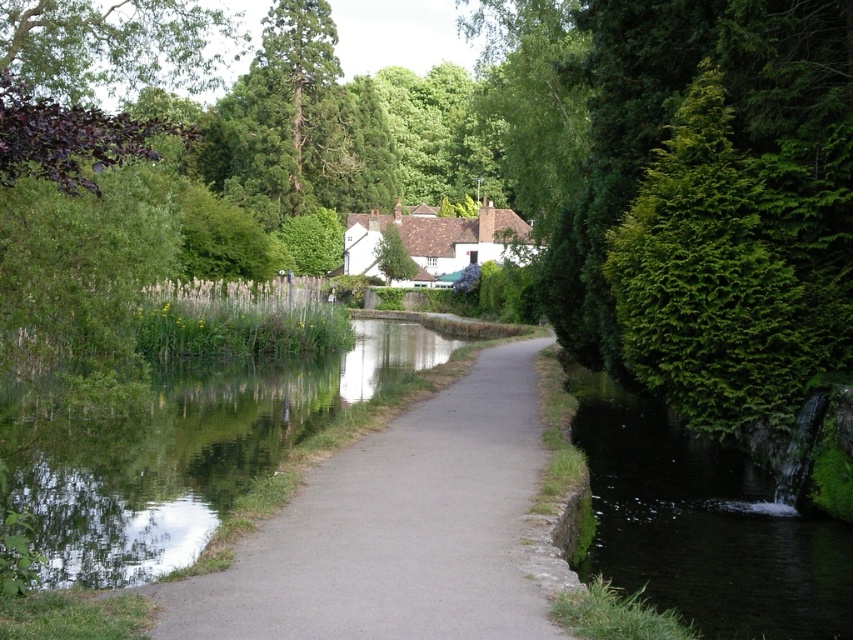
How much distance is there between smooth asphalt path at center and white matte cottage at center?

They are 66.21 meters apart.

Which is in front, point (157, 632) or point (489, 237)?

Point (157, 632) is more forward.

Identify the location of smooth asphalt path at center. This screenshot has height=640, width=853. (396, 529).

Between green textured hedge at right and green leafy tree at center, which one appears on the right side from the viewer's perspective?

From the viewer's perspective, green textured hedge at right appears more on the right side.

Can you confirm if green textured hedge at right is smaller than green leafy tree at center?

Correct, green textured hedge at right occupies less space than green leafy tree at center.

In order to click on green textured hedge at right in this screenshot , I will do tap(734, 268).

The width and height of the screenshot is (853, 640). Describe the element at coordinates (396, 529) in the screenshot. I see `smooth asphalt path at center` at that location.

Does smooth asphalt path at center appear on the left side of green leafy tree at center?

In fact, smooth asphalt path at center is to the right of green leafy tree at center.

Which is behind, point (410, 586) or point (386, 262)?

Point (386, 262)

The width and height of the screenshot is (853, 640). I want to click on smooth asphalt path at center, so click(396, 529).